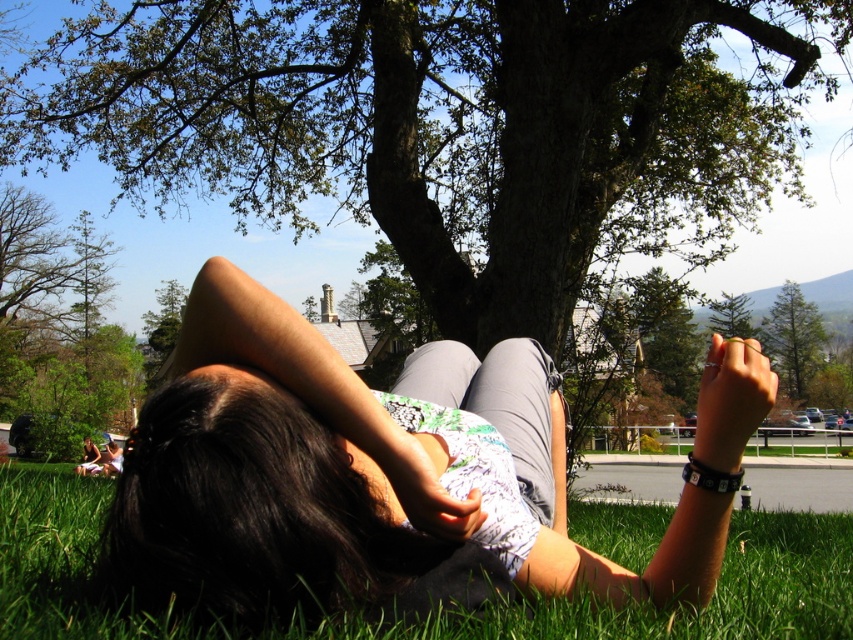
Question: Does green leafy tree at upper center appear under green leafy tree at upper right?

Choices:
 (A) no
 (B) yes

Answer: (A)

Question: Which object is the closest to the green leafy tree at upper center?

Choices:
 (A) smooth skin at center
 (B) matte gray pants at center

Answer: (B)

Question: Is matte gray pants at center bigger than green leafy tree at upper right?

Choices:
 (A) yes
 (B) no

Answer: (B)

Question: Which point appears closest to the camera in this image?

Choices:
 (A) (804, 316)
 (B) (850, 624)
 (C) (440, 488)
 (D) (196, 56)

Answer: (C)

Question: Considering the relative positions of green leafy tree at upper center and matte gray pants at center in the image provided, where is green leafy tree at upper center located with respect to matte gray pants at center?

Choices:
 (A) left
 (B) right

Answer: (B)

Question: Among these points, which one is nearest to the camera?

Choices:
 (A) (625, 88)
 (B) (392, 492)
 (C) (753, 596)
 (D) (786, 301)

Answer: (B)